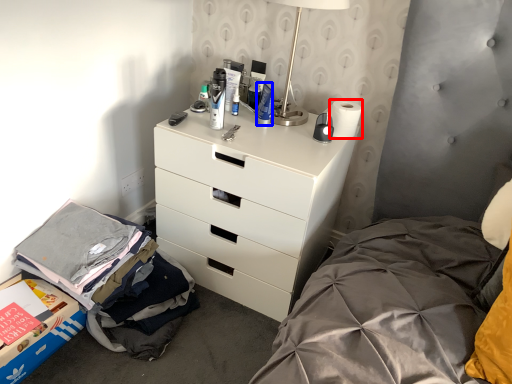
Question: Which point is further to the camera, toilet paper (highlighted by a red box) or toiletry (highlighted by a blue box)?

Choices:
 (A) toilet paper
 (B) toiletry

Answer: (A)